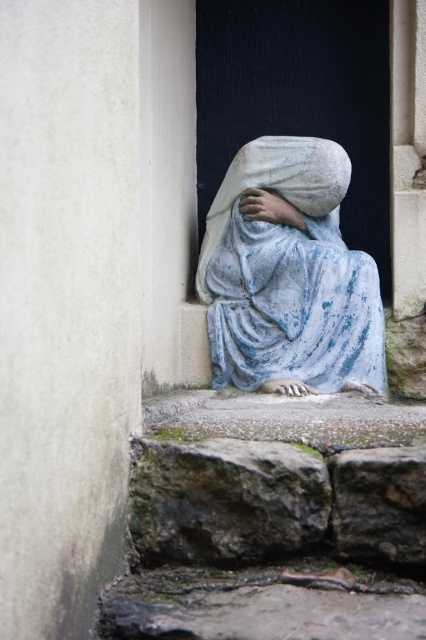
You are standing in front of the stone sculpture in the alcove. To your left, there are rough stone stairs at lower left. If you want to climb down from the current level, which direction should you head towards?

You should head towards the rough stone stairs at lower left located at point [273,520] to climb down from the current level.